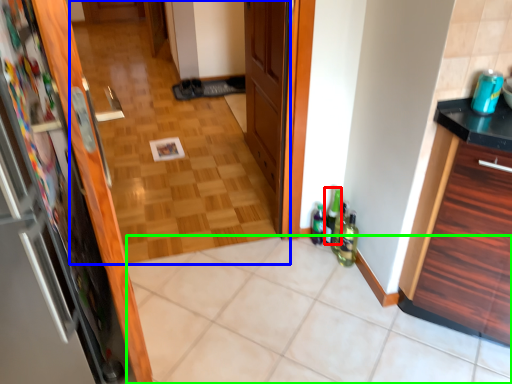
Question: Based on their relative distances, which object is nearer to bottle (highlighted by a red box)? Choose from corridor (highlighted by a blue box) and tile (highlighted by a green box).

Choices:
 (A) corridor
 (B) tile

Answer: (B)